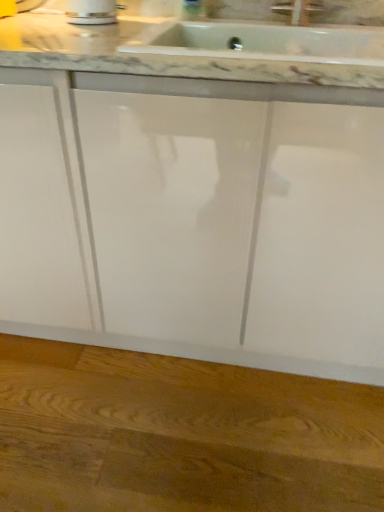
What do you see at coordinates (195, 192) in the screenshot?
I see `marble at center` at bounding box center [195, 192].

In order to face marble at center, should I rotate leftwards or rightwards?

You should rotate left by 3.567 degrees.

Find the location of `marble at center`. marble at center is located at coordinates (195, 192).

The image size is (384, 512). Find the location of `marble at center`. marble at center is located at coordinates (195, 192).